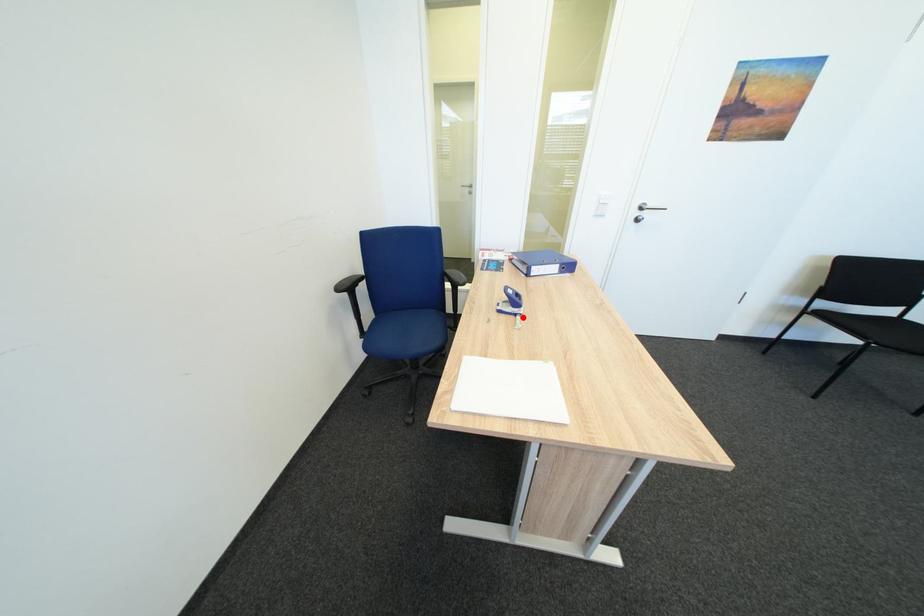
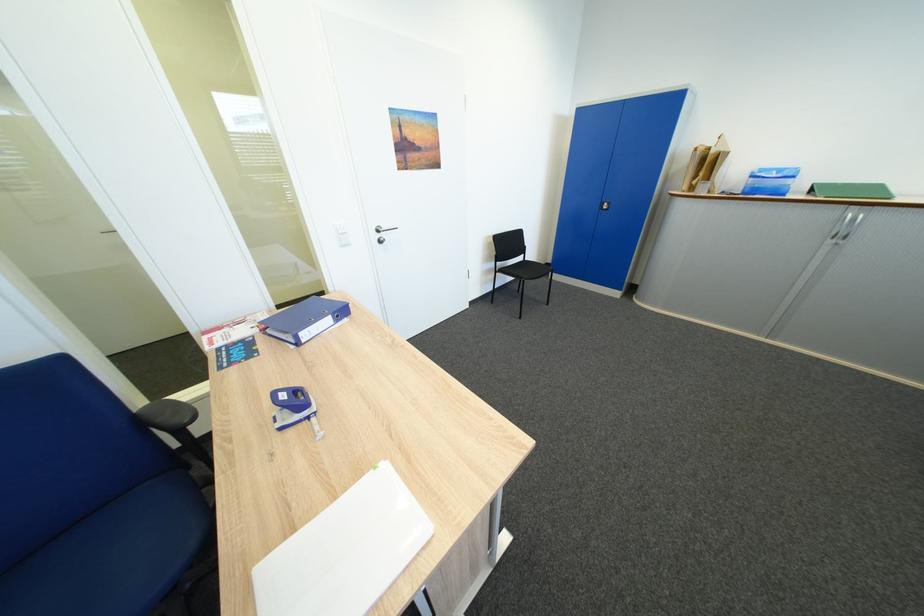
The point at the highlighted location is marked in the first image. Where is the corresponding point in the second image?

(314, 424)